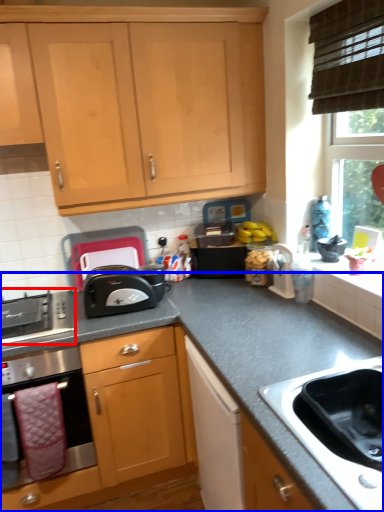
Question: Among these objects, which one is nearest to the camera, gas stove (highlighted by a red box) or countertop (highlighted by a blue box)?

Choices:
 (A) gas stove
 (B) countertop

Answer: (B)